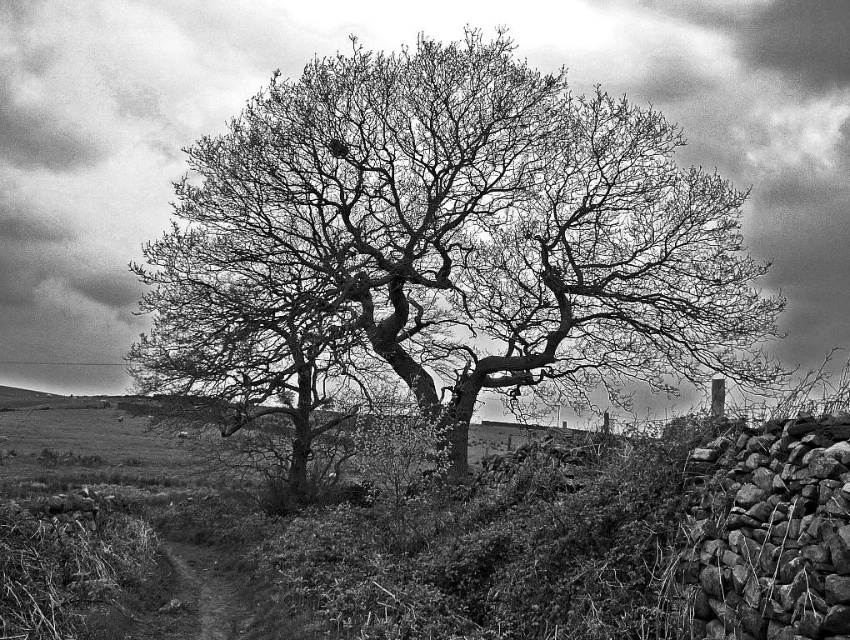
Based on the scene described, if you were standing at the base of the bare branches at center, which direction would you need to walk to reach the grassy hillside at center?

To reach the grassy hillside at center from the base of the bare branches at center, you would need to walk to the left since the bare branches at center are positioned to the right of the grassy hillside at center.

You are an artist planning to paint this scene. You want to focus on the bare branches at center and the grassy hillside at center. Which of these two elements should you allocate more canvas space to, and why?

You should allocate more canvas space to the grassy hillside at center because the bare branches at center occupies less space than grassy hillside at center in the original image.

You are standing in the rural landscape looking at the solitary tree and the stone wall. There are two points marked in the image. Which point is closer to you, point (471, 333) or point (358, 515)?

Point (471, 333) is further to the viewer than point (358, 515), so point (358, 515) is closer to you.